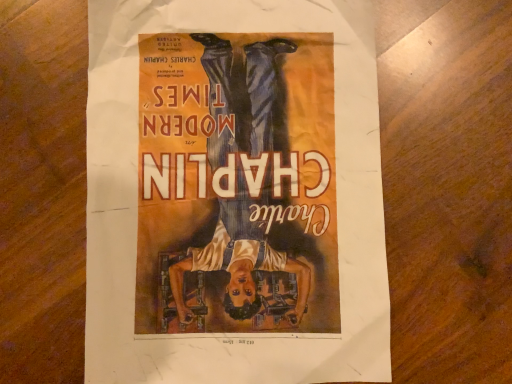
Where is `free location above matte paper poster at center (from a real-world perspective)`? The height and width of the screenshot is (384, 512). free location above matte paper poster at center (from a real-world perspective) is located at coordinates (230, 160).